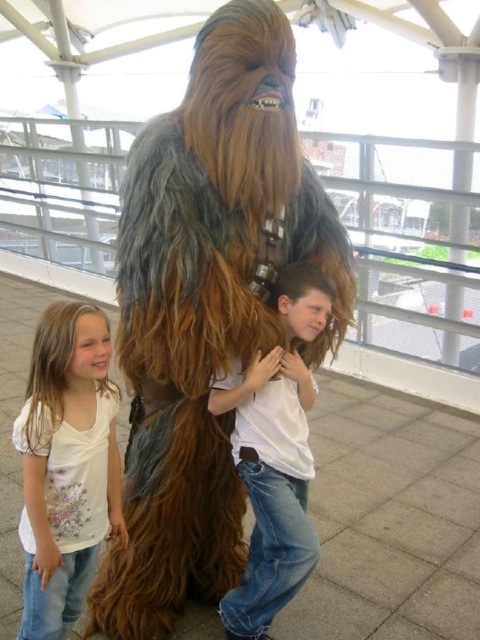
Question: Observing the image, what is the correct spatial positioning of white floral shirt at left in reference to white cotton shirt at center?

Choices:
 (A) left
 (B) right

Answer: (A)

Question: Is white floral shirt at left positioned in front of white cotton shirt at center?

Choices:
 (A) no
 (B) yes

Answer: (B)

Question: Which point is farther to the camera?

Choices:
 (A) white floral shirt at left
 (B) white cotton shirt at center

Answer: (B)

Question: Does white floral shirt at left have a larger size compared to white cotton shirt at center?

Choices:
 (A) yes
 (B) no

Answer: (B)

Question: Which point appears closest to the camera in this image?

Choices:
 (A) (33, 604)
 (B) (287, 477)

Answer: (A)